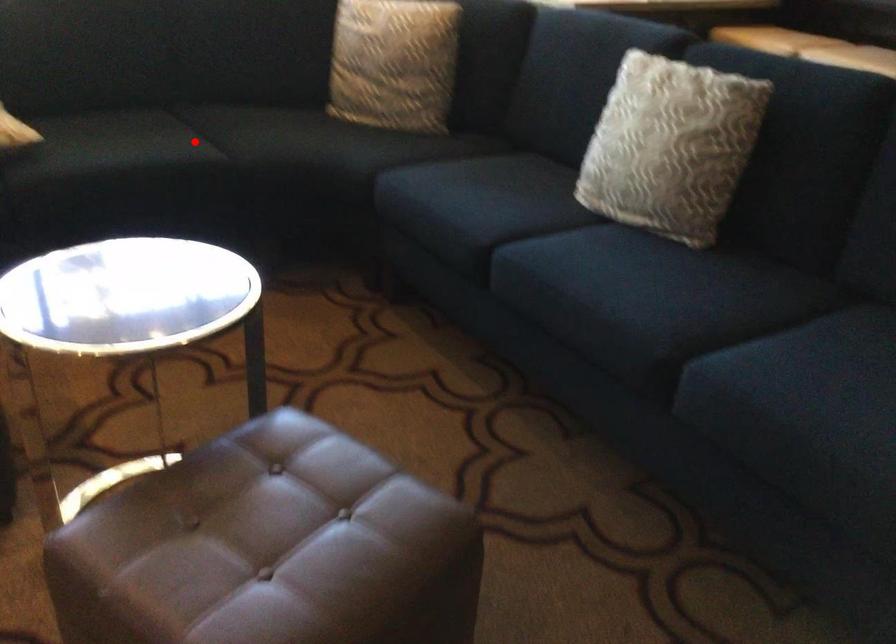
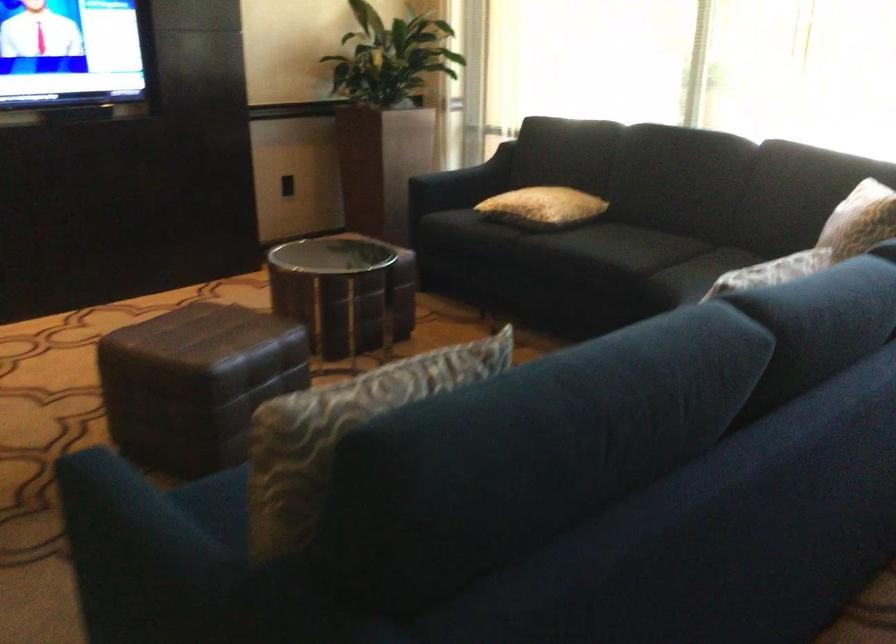
The point at the highlighted location is marked in the first image. Where is the corresponding point in the second image?

(626, 254)